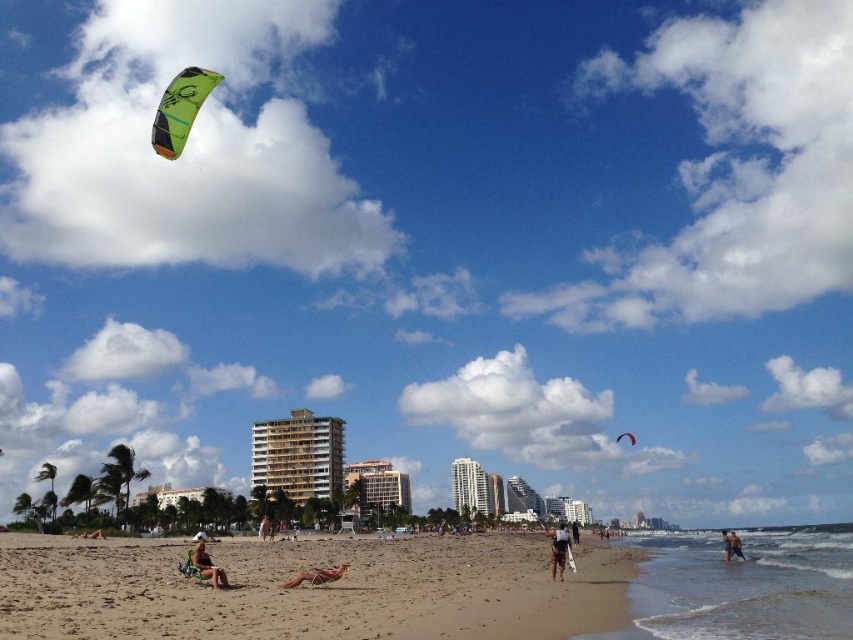
Who is lower down, tan skin person at lower left or green fabric parachute at upper center?

Positioned lower is green fabric parachute at upper center.

Is tan skin person at lower left bigger than green fabric parachute at upper center?

Yes, tan skin person at lower left is bigger than green fabric parachute at upper center.

What are the coordinates of `tan skin person at lower left` in the screenshot? It's located at (91, 534).

This screenshot has height=640, width=853. In order to click on tan skin person at center in this screenshot , I will do `click(263, 528)`.

Measure the distance between point [259,536] and camera.

Point [259,536] is 102.93 meters from camera.

The image size is (853, 640). In order to click on tan skin person at center in this screenshot , I will do `click(263, 528)`.

Which is in front, point (308, 433) or point (94, 536)?

Point (94, 536) is more forward.

Who is more distant from viewer, [273,440] or [83,532]?

Point [273,440]

Who is more distant from viewer, (305, 483) or (102, 529)?

The point (305, 483) is behind.

I want to click on gold textured building at center, so click(297, 456).